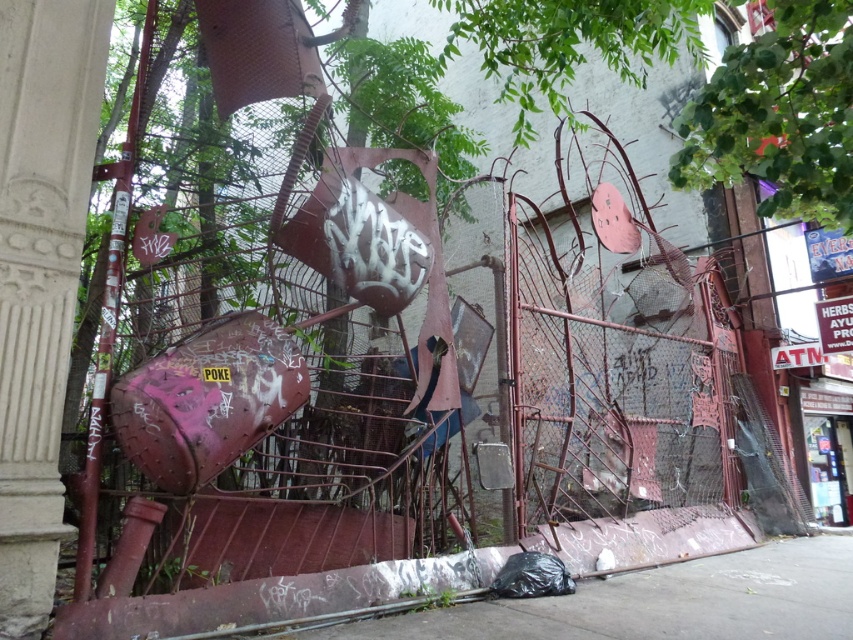
Question: Can you confirm if concrete pavement at lower center is thinner than green leafy tree at upper right?

Choices:
 (A) yes
 (B) no

Answer: (B)

Question: Which of the following is the farthest from the observer?

Choices:
 (A) (718, 100)
 (B) (33, 125)

Answer: (B)

Question: Considering the real-world distances, which object is closest to the concrete pavement at lower center?

Choices:
 (A) white carved stone pillar at left
 (B) green leafy tree at upper right

Answer: (B)

Question: Which of the following is the farthest from the observer?

Choices:
 (A) concrete pavement at lower center
 (B) green leafy tree at upper right
 (C) white carved stone pillar at left

Answer: (A)

Question: Does concrete pavement at lower center appear on the right side of green leafy tree at upper right?

Choices:
 (A) no
 (B) yes

Answer: (A)

Question: Is white carved stone pillar at left below concrete pavement at lower center?

Choices:
 (A) yes
 (B) no

Answer: (B)